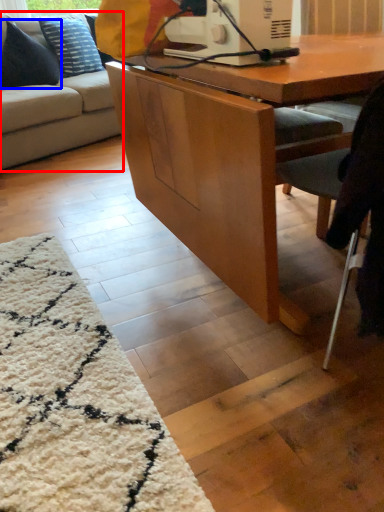
Question: Which of the following is the closest to the observer, studio couch (highlighted by a red box) or pillow (highlighted by a blue box)?

Choices:
 (A) studio couch
 (B) pillow

Answer: (A)